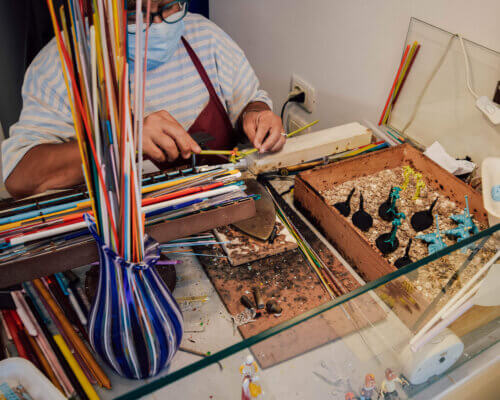
Find the location of a particular element. This screenshot has height=400, width=500. dirty wooden slab is located at coordinates (283, 271).